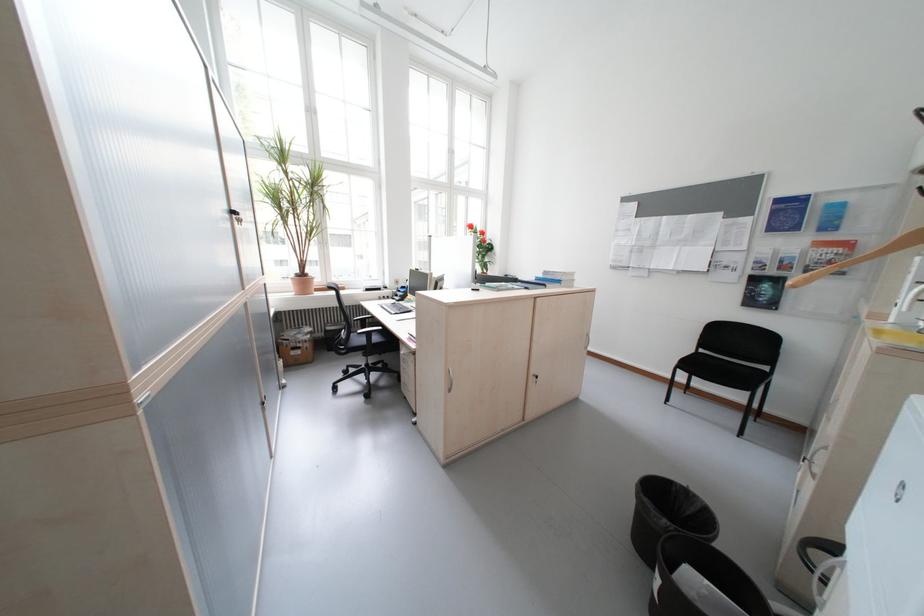
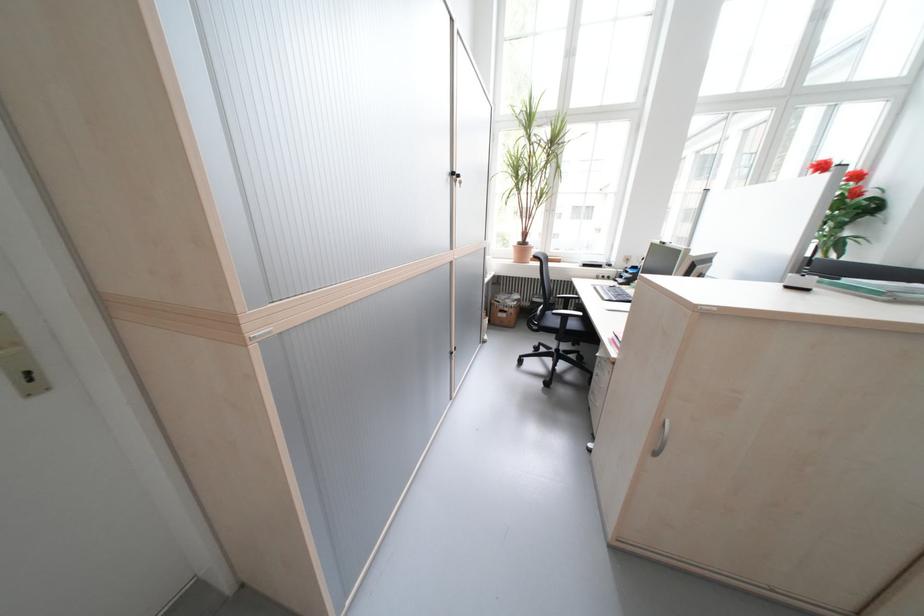
The point at [400,297] is marked in the first image. Where is the corresponding point in the second image?

(623, 278)